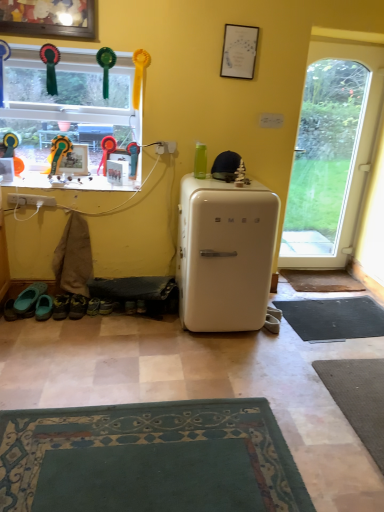
Question: From the image's perspective, is green fabric shoe at lower left, the 2th shoe when ordered from left to right, above or below green rubber clogs at lower left, the third footwear positioned from the right?

Choices:
 (A) above
 (B) below

Answer: (B)

Question: Is green fabric shoe at lower left, the 2th shoe when ordered from left to right, wider or thinner than green rubber clogs at lower left, the third footwear positioned from the right?

Choices:
 (A) thin
 (B) wide

Answer: (A)

Question: Which object is the closest to the black rubber doormat at lower right?

Choices:
 (A) wooden photo frame at upper left, the 1th picture frame when ordered from bottom to top
 (B) glass window at upper left
 (C) brown leather shoes at lower left, which ranks as the third footwear in left-to-right order
 (D) brown textured mat at lower right
 (E) matte white picture frame at upper center, the first picture frame from the top

Answer: (D)

Question: Estimate the real-world distances between objects in this image. Which object is farther from the matte white picture frame at upper center, the second picture frame in the bottom-to-top sequence?

Choices:
 (A) brown leather shoes at lower left, which ranks as the third footwear in left-to-right order
 (B) green fabric shoe at lower left, which is the first shoe in right-to-left order
 (C) teal fabric shoes at lower left, arranged as the second footwear when viewed from the left
 (D) green rubber clogs at lower left, the third footwear positioned from the right
 (E) transparent glass door at right

Answer: (C)